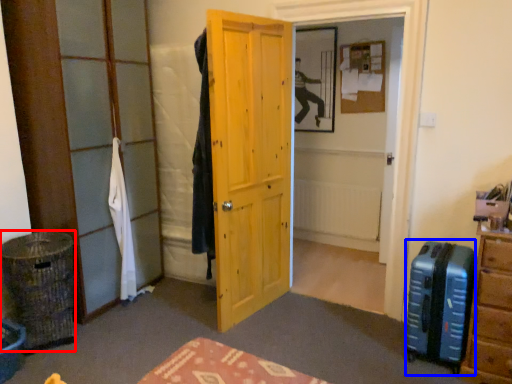
Question: Among these objects, which one is farthest to the camera, laundry basket (highlighted by a red box) or luggage (highlighted by a blue box)?

Choices:
 (A) laundry basket
 (B) luggage

Answer: (A)